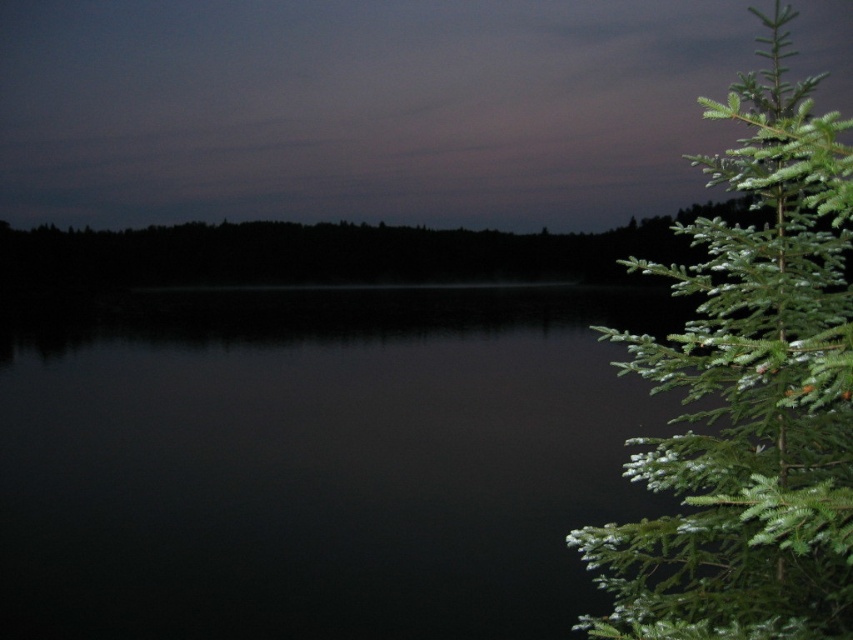
Question: Does dark water at center lie in front of green needle-like fir tree at right?

Choices:
 (A) yes
 (B) no

Answer: (B)

Question: Can you confirm if dark water at center is positioned to the left of green needle-like fir tree at right?

Choices:
 (A) yes
 (B) no

Answer: (A)

Question: Which point is farther from the camera taking this photo?

Choices:
 (A) (416, 394)
 (B) (817, 620)

Answer: (A)

Question: Does dark water at center appear over green needle-like fir tree at right?

Choices:
 (A) yes
 (B) no

Answer: (B)

Question: Which point is closer to the camera?

Choices:
 (A) green needle-like fir tree at right
 (B) dark water at center

Answer: (A)